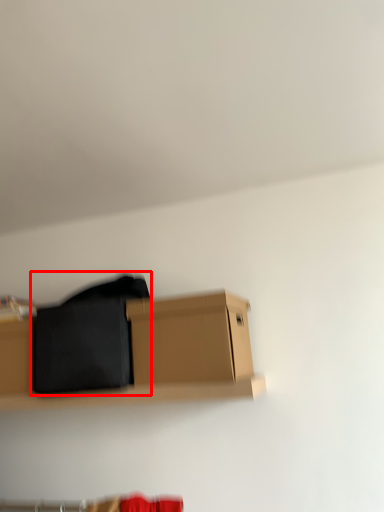
Question: From the image's perspective, what is the correct spatial relationship of clothing (annotated by the red box) in relation to box?

Choices:
 (A) below
 (B) above

Answer: (A)